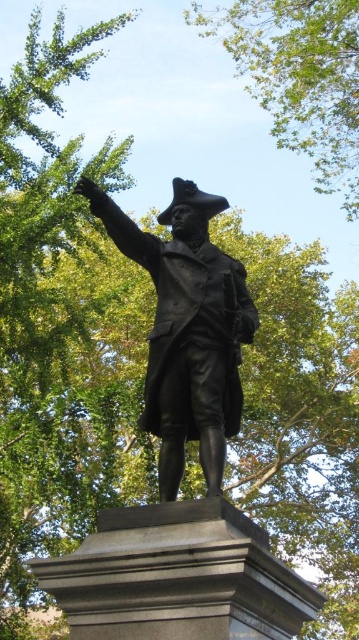
Question: Which object is closer to the camera taking this photo?

Choices:
 (A) green leafy tree at upper center
 (B) bronze statue at center

Answer: (B)

Question: Which point is farther to the camera?

Choices:
 (A) (160, 435)
 (B) (285, 52)

Answer: (B)

Question: From the image, what is the correct spatial relationship of bronze statue at center in relation to green leafy tree at upper center?

Choices:
 (A) left
 (B) right

Answer: (A)

Question: Is bronze statue at center above green leafy tree at upper center?

Choices:
 (A) yes
 (B) no

Answer: (B)

Question: Which of the following is the closest to the observer?

Choices:
 (A) (299, 124)
 (B) (174, 310)

Answer: (B)

Question: Can you confirm if bronze statue at center is positioned to the left of green leafy tree at upper center?

Choices:
 (A) yes
 (B) no

Answer: (A)